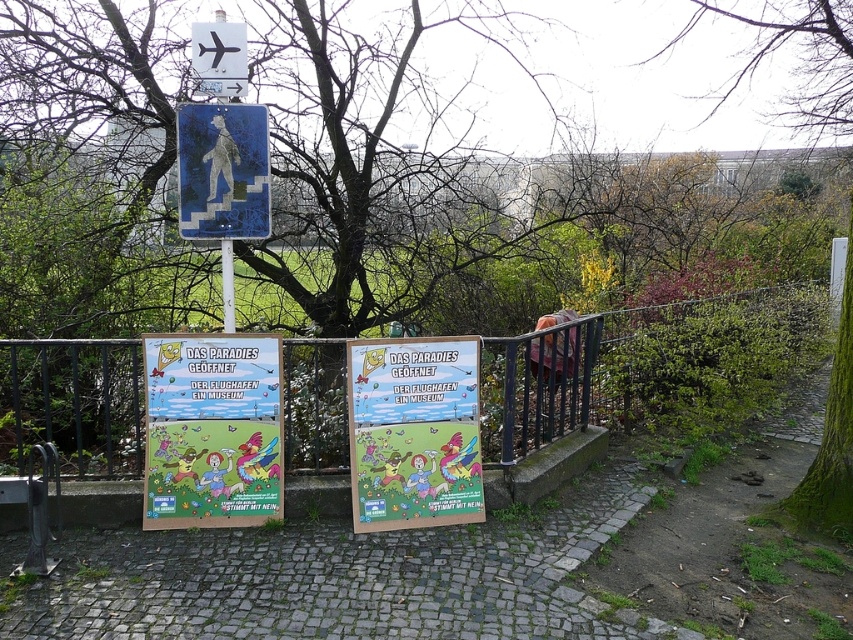
Question: Is cobblestone path at center smaller than green mossy tree at upper right?

Choices:
 (A) no
 (B) yes

Answer: (B)

Question: Which object is the closest to the cobblestone path at center?

Choices:
 (A) black plastic airplane at upper center
 (B) green leafy tree at center
 (C) green mossy tree at upper right

Answer: (A)

Question: Is cardboard poster at center to the right of matte cardboard poster at center from the viewer's perspective?

Choices:
 (A) yes
 (B) no

Answer: (B)

Question: Is black metal fence at lower center wider than cardboard poster at center?

Choices:
 (A) yes
 (B) no

Answer: (B)

Question: Which of the following is the farthest from the observer?

Choices:
 (A) green leafy tree at center
 (B) cardboard poster at center

Answer: (A)

Question: Based on their relative distances, which object is farther from the black metal fence at lower center?

Choices:
 (A) matte cardboard poster at center
 (B) cardboard poster at center

Answer: (A)